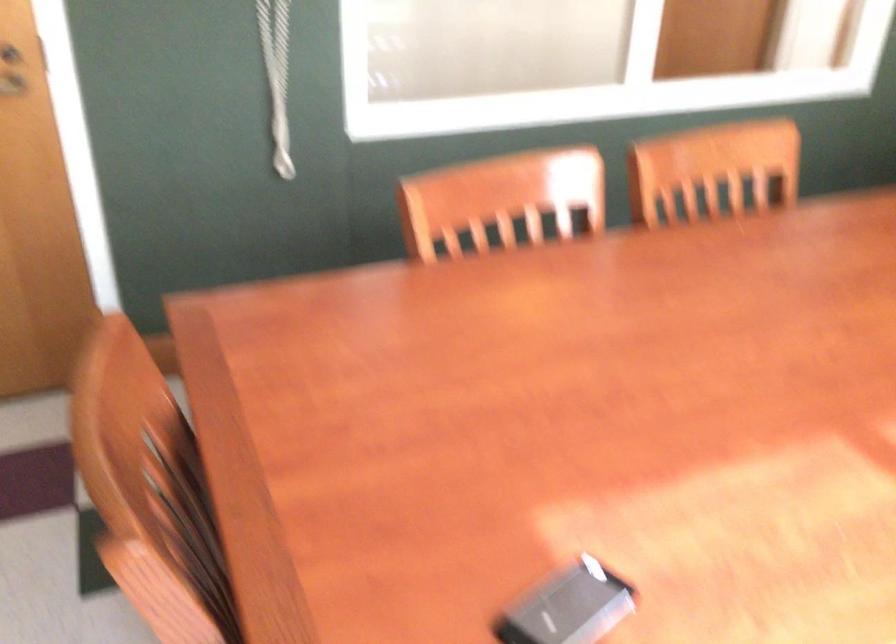
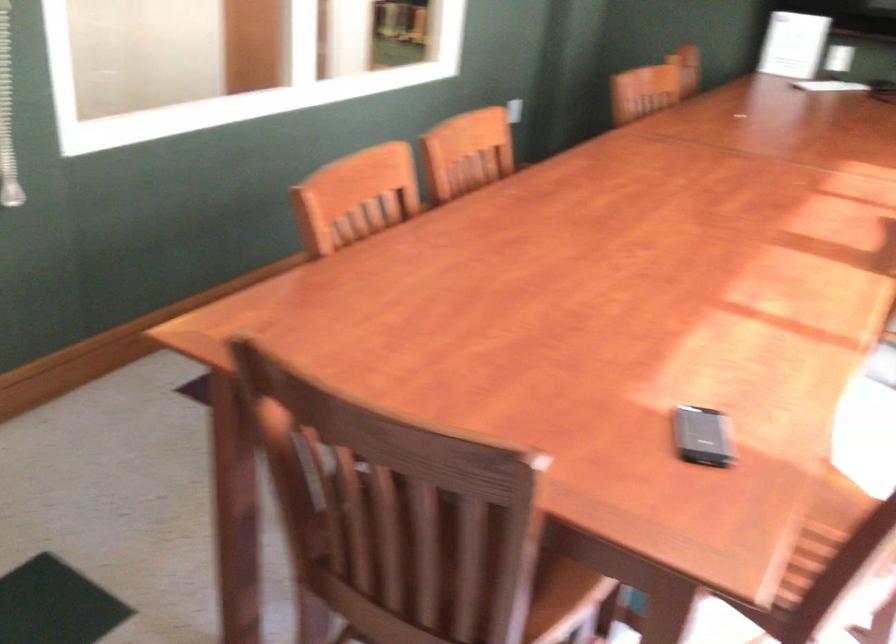
Question: The first image is from the beginning of the video and the second image is from the end. How did the camera likely rotate when shooting the video?

Choices:
 (A) Left
 (B) Right
 (C) Up
 (D) Down

Answer: (B)